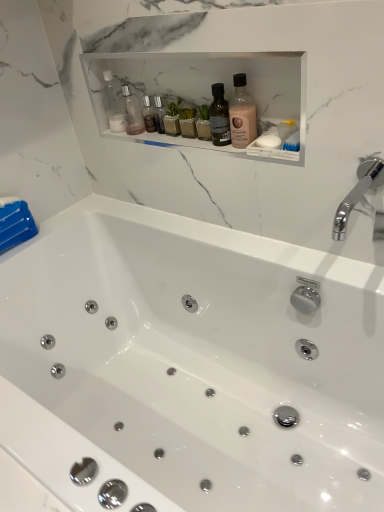
Question: Considering their positions, is transparent plastic bottle at upper center, acting as the first bottle starting from the left, located in front of or behind transparent plastic bottle at upper center, which is the 1th bottle in back-to-front order?

Choices:
 (A) behind
 (B) front

Answer: (B)

Question: Does point (117, 95) appear closer or farther from the camera than point (135, 119)?

Choices:
 (A) closer
 (B) farther

Answer: (A)

Question: Estimate the real-world distances between objects in this image. Which object is closer to the transparent plastic bottle at upper center, acting as the second bottle starting from the front?

Choices:
 (A) pink matte bottle at center, arranged as the 3th bottle when viewed from the left
 (B) transparent plastic bottle at upper center, marked as the 3th bottle in a front-to-back arrangement
 (C) white matte soap at right
 (D) white glossy bathtub at center
 (E) chrome metallic faucet at upper right

Answer: (B)

Question: Estimate the real-world distances between objects in this image. Which object is closer to the white glossy bathtub at center?

Choices:
 (A) white matte soap at right
 (B) pink matte bottle at center, the 1th bottle viewed from the front
 (C) chrome metallic faucet at upper right
 (D) transparent plastic bottle at upper center, which ranks as the 3th bottle in right-to-left order
 (E) transparent plastic bottle at upper center, which is the 1th bottle in back-to-front order

Answer: (C)